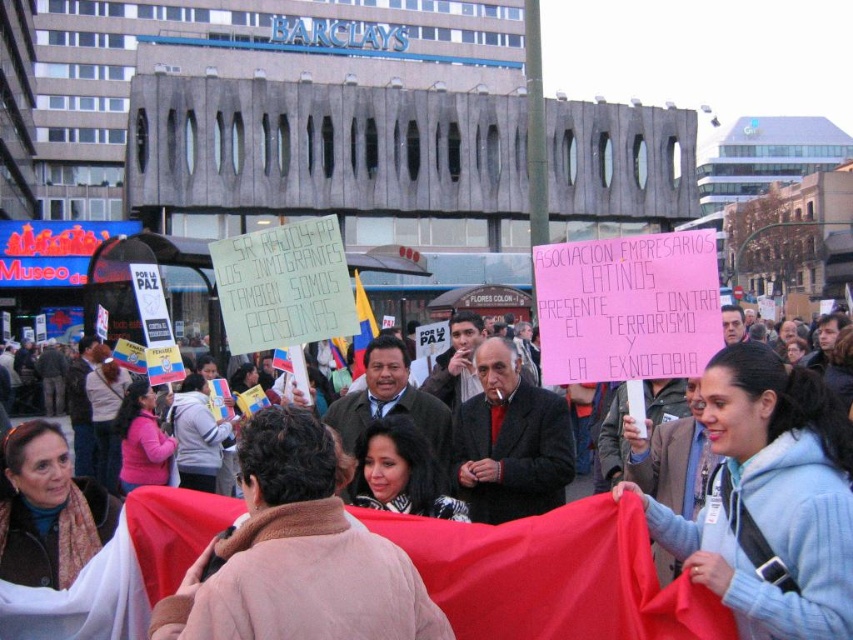
You are a photographer at the demonstration. You need to capture a photo that includes both the smooth black hair at center and the pink fleece jacket at lower left. Based on their positions, which object should be placed lower in the frame to ensure both are visible?

The smooth black hair at center is located below the pink fleece jacket at lower left, so to include both in the frame, the pink fleece jacket at lower left should be placed higher and the smooth black hair at center lower in the frame.

Looking at this image, you are a photographer positioned at the edge of the demonstration. You want to capture a photo that includes both the light blue fleece jacket at lower right and the brown scarf at center. Which object should you adjust your focus to include first in your frame?

The light blue fleece jacket at lower right is in front of the brown scarf at center, so you should focus on including the light blue fleece jacket at lower right first to ensure both are visible in the frame.

You are a photographer at the demonstration. You want to capture a photo that includes both the smooth black hair at center and the pink fleece jacket at lower left. Based on their positions, which object should you adjust your camera to focus on first to ensure both are in the frame?

The smooth black hair at center is positioned on the right side of pink fleece jacket at lower left. To include both in the frame, focus on the pink fleece jacket at lower left first, then adjust to include the smooth black hair at center on its right.